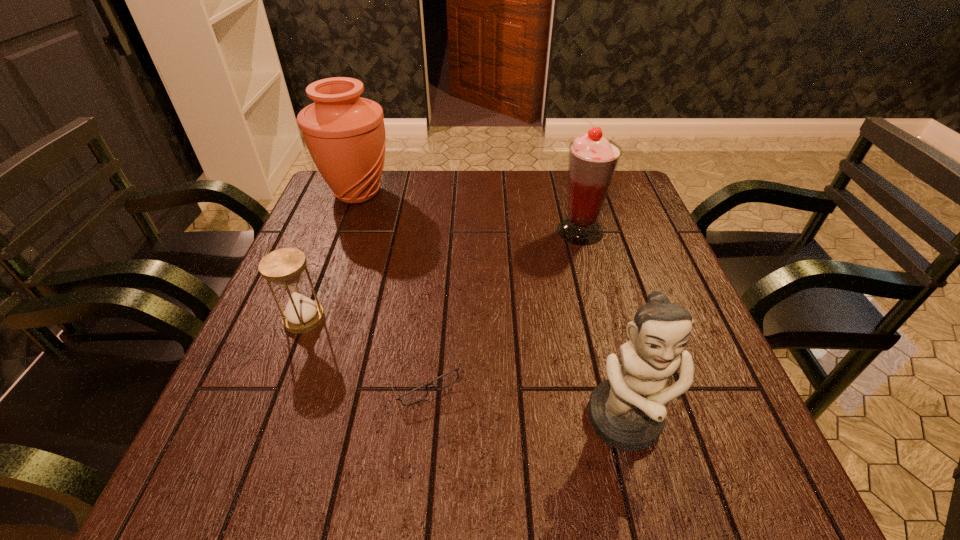
Where is `vase`? The width and height of the screenshot is (960, 540). vase is located at coordinates (345, 134).

This screenshot has width=960, height=540. I want to click on the second farthest object, so click(593, 160).

At what (x,y) coordinates should I click in order to perform the action: click on figurine. Please return your answer as a coordinate pair (x, y). Image resolution: width=960 pixels, height=540 pixels. Looking at the image, I should click on (627, 412).

Locate an element on the screen. This screenshot has width=960, height=540. the second shortest object is located at coordinates (284, 267).

What are the coordinates of `hourglass` in the screenshot? It's located at (284, 267).

Locate an element on the screen. The height and width of the screenshot is (540, 960). the shortest object is located at coordinates (445, 380).

In order to click on spectacles in this screenshot , I will do `click(445, 380)`.

Image resolution: width=960 pixels, height=540 pixels. Identify the location of free space located on the front of the farthest object. (320, 293).

Locate an element on the screen. free space located 0.200m on the left of the fourth nearest object is located at coordinates (482, 231).

This screenshot has height=540, width=960. I want to click on blank area located 0.100m on the front of the second shortest object, so click(x=282, y=374).